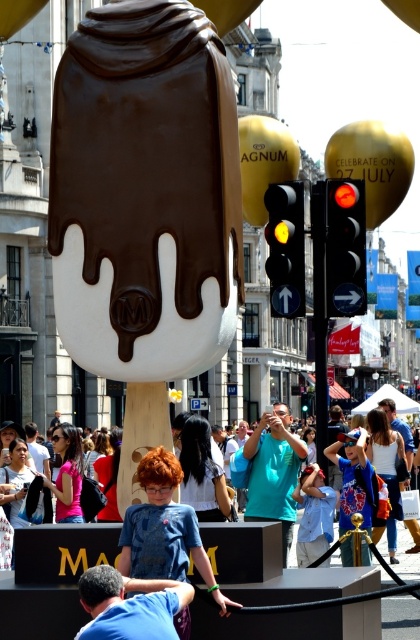
In the scene shown: Does smooth chocolate ice cream at center appear over denim shirt at center?

Correct, smooth chocolate ice cream at center is located above denim shirt at center.

This screenshot has width=420, height=640. I want to click on smooth chocolate ice cream at center, so click(x=144, y=193).

Which is behind, point (136, 298) or point (302, 512)?

Positioned behind is point (302, 512).

Image resolution: width=420 pixels, height=640 pixels. I want to click on smooth chocolate ice cream at center, so click(144, 193).

Can you confirm if denim jacket at center is thinner than denim shirt at center?

No.

Looking at this image, does denim jacket at center have a smaller size compared to denim shirt at center?

No.

Measure the distance between point [367,477] and camera.

A distance of 70.36 meters exists between point [367,477] and camera.

Locate an element on the screen. This screenshot has height=640, width=420. denim jacket at center is located at coordinates (354, 480).

Which is behind, point (257, 483) or point (385, 547)?

The point (385, 547) is behind.

Can you confirm if teal t-shirt at center is bigger than matte white crowd at center?

No, teal t-shirt at center is not bigger than matte white crowd at center.

Which is in front, point (293, 480) or point (401, 570)?

Positioned in front is point (293, 480).

At what (x,y) coordinates should I click in order to perform the action: click on teal t-shirt at center. Please return your answer as a coordinate pair (x, y). This screenshot has height=640, width=420. Looking at the image, I should click on (273, 472).